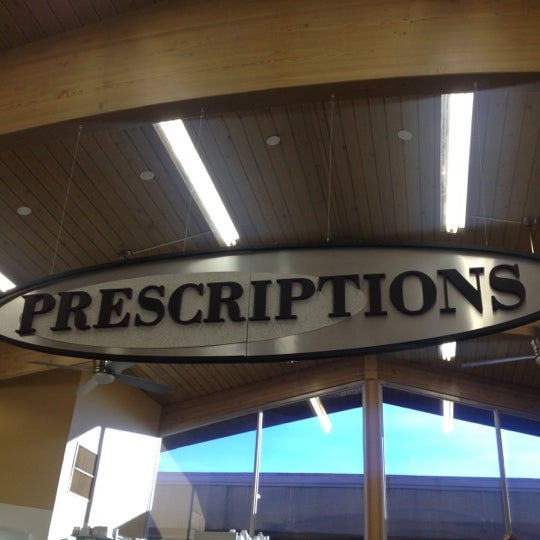
Locate an element on the screen. Image resolution: width=540 pixels, height=540 pixels. reflections of fluorescent lights in windows is located at coordinates (323, 417), (444, 421).